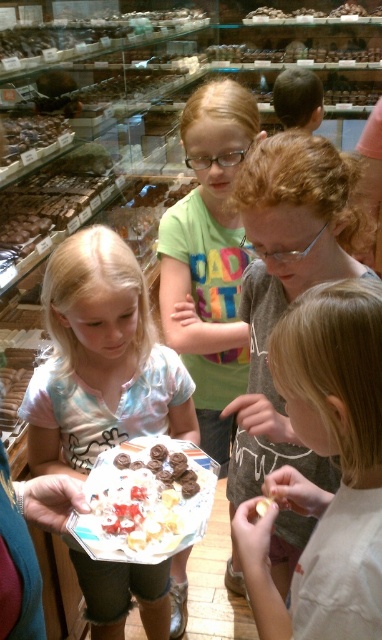
Question: Which point is closer to the camera?

Choices:
 (A) pastel tie-dye shirt at center
 (B) green cotton shirt at center

Answer: (A)

Question: Which object is the farthest from the pastel tie-dye shirt at center?

Choices:
 (A) light brown hair at center
 (B) green cotton shirt at center

Answer: (A)

Question: Does green cotton shirt at center have a lesser width compared to white creamy cake at center?

Choices:
 (A) no
 (B) yes

Answer: (A)

Question: Which is nearer to the light brown hair at center?

Choices:
 (A) white creamy cake at center
 (B) green cotton shirt at center
 (C) pastel tie-dye shirt at center

Answer: (A)

Question: Does light brown hair at center appear over white creamy cake at center?

Choices:
 (A) no
 (B) yes

Answer: (B)

Question: Can you confirm if pastel tie-dye shirt at center is positioned to the left of green cotton shirt at center?

Choices:
 (A) yes
 (B) no

Answer: (A)